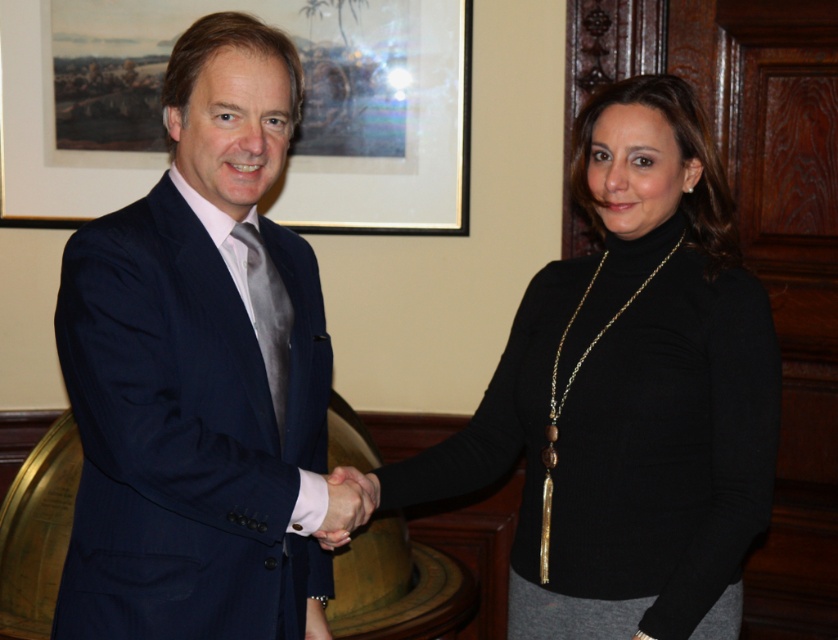
Looking at this image, you are an interior designer planning to place a new decorative item between the black matte turtleneck at center and the wooden picture frame at upper center. Given the distance between them, what is the maximum length of the item you can place without it touching either object?

The distance between the black matte turtleneck at center and the wooden picture frame at upper center is 1.50 meters. To ensure the decorative item doesn not touch either object, the maximum length should be less than 1.50 meters.

You are standing in front of the scene and want to reach both points. Which point is closer to you, point (x=637, y=408) or point (x=388, y=16)?

Point (x=637, y=408) is closer to the viewer than point (x=388, y=16).

You are an interior designer assessing the layout of a room. You notice the black matte turtleneck at center and the wooden picture frame at upper center. Based on their positions, which object is closer to the bottom of the image?

The black matte turtleneck at center is located below the wooden picture frame at upper center, so it is closer to the bottom of the image.